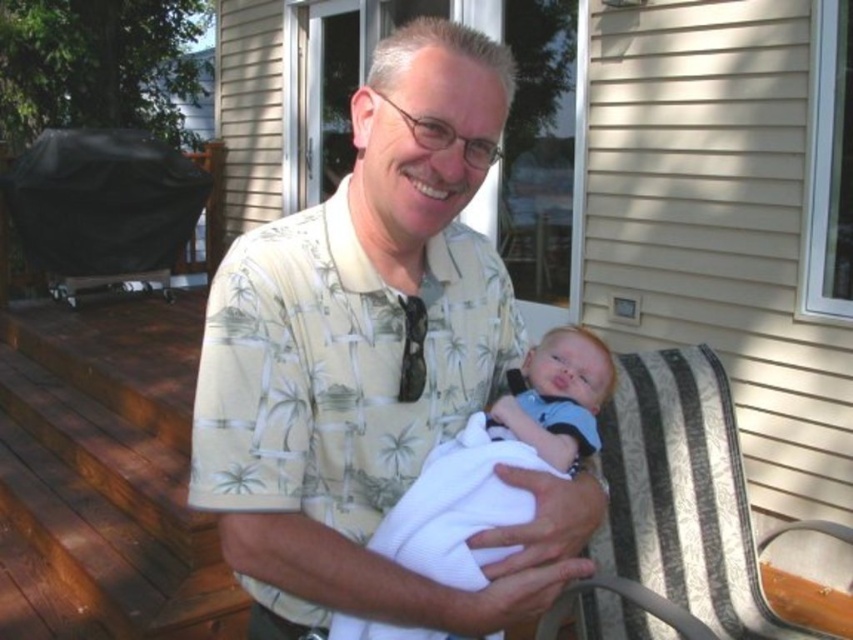
You are a photographer trying to capture a candid shot of the white clothed baby at center and the patterned fabric rocking chair at right. From your current position, which object would you need to adjust your angle to include in the frame first?

The patterned fabric rocking chair at right is located below the white clothed baby at center, so you would need to adjust your angle to include the patterned fabric rocking chair at right first since it is lower in position.

You are a photographer trying to capture the baby in the image without any obstructions. The white clothed baby at center and the matte black tie at center are in your viewfinder. Which object should you adjust to ensure the baby is fully visible?

The matte black tie at center is blocking the white clothed baby at center, so you should adjust the matte black tie at center to ensure the baby is fully visible.